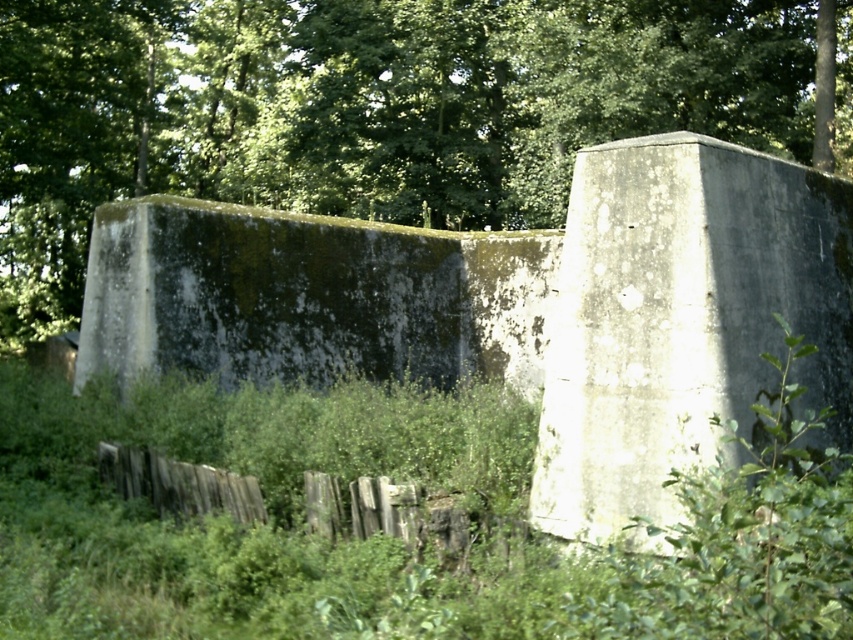
Does green mossy concrete wall at center lie in front of weathered wood fence at lower center?

No, green mossy concrete wall at center is behind weathered wood fence at lower center.

Can you confirm if green mossy concrete wall at center is taller than weathered wood fence at lower center?

Yes.

What do you see at coordinates (309, 296) in the screenshot?
I see `green mossy concrete wall at center` at bounding box center [309, 296].

Identify the location of green mossy concrete wall at center. Image resolution: width=853 pixels, height=640 pixels. (309, 296).

How much distance is there between green leafy tree at upper center and gray concrete wall at center?

A distance of 62.62 feet exists between green leafy tree at upper center and gray concrete wall at center.

Which is in front, point (339, 77) or point (648, 136)?

Point (648, 136) is in front.

At what (x,y) coordinates should I click in order to perform the action: click on green leafy tree at upper center. Please return your answer as a coordinate pair (x, y). This screenshot has width=853, height=640. Looking at the image, I should click on (358, 108).

Which is more to the right, green leafy tree at upper center or weathered wood fence at lower center?

weathered wood fence at lower center

Can you confirm if green leafy tree at upper center is positioned below weathered wood fence at lower center?

No, green leafy tree at upper center is not below weathered wood fence at lower center.

Locate an element on the screen. green leafy tree at upper center is located at coordinates (358, 108).

Where is `green leafy tree at upper center`? The height and width of the screenshot is (640, 853). green leafy tree at upper center is located at coordinates (358, 108).